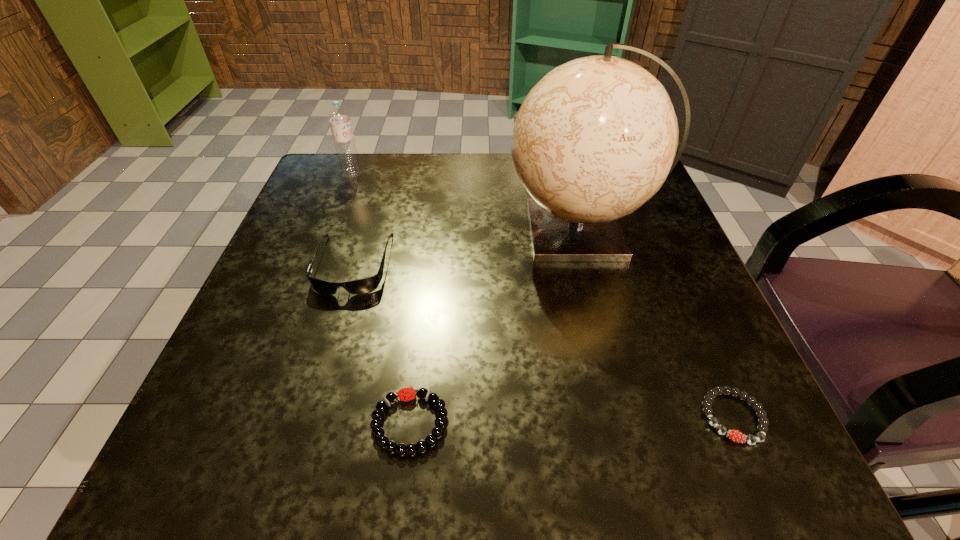
The image size is (960, 540). Find the location of `bracelet at the right edge`. bracelet at the right edge is located at coordinates (734, 435).

Image resolution: width=960 pixels, height=540 pixels. I want to click on object positioned at the far left corner, so click(339, 118).

The width and height of the screenshot is (960, 540). Find the location of `object located in the far right corner section of the desktop`. object located in the far right corner section of the desktop is located at coordinates (596, 137).

Locate an element on the screen. This screenshot has height=540, width=960. object positioned at the near right corner is located at coordinates (734, 435).

Where is `free spot at the far edge of the desktop`? This screenshot has width=960, height=540. free spot at the far edge of the desktop is located at coordinates (513, 173).

Locate an element on the screen. free space at the near edge of the desktop is located at coordinates (319, 457).

This screenshot has height=540, width=960. What are the coordinates of `free space at the left edge of the desktop` in the screenshot? It's located at (290, 219).

In the image, there is a desktop. Where is `free region at the right edge`? The height and width of the screenshot is (540, 960). free region at the right edge is located at coordinates (636, 247).

The width and height of the screenshot is (960, 540). I want to click on blank space at the far left corner of the desktop, so click(380, 187).

You are a GUI agent. You are given a task and a screenshot of the screen. Output one action in this format:
    pyautogui.click(x=<x>, y=<y>)
    Task: Click on the empty location between the second shortest object and the third tallest object
    This screenshot has width=960, height=540.
    Given the screenshot: What is the action you would take?
    pyautogui.click(x=381, y=343)